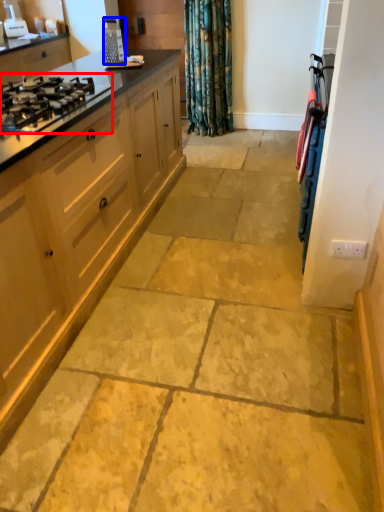
Question: Among these objects, which one is nearest to the camera, gas stove (highlighted by a red box) or appliance (highlighted by a blue box)?

Choices:
 (A) gas stove
 (B) appliance

Answer: (A)